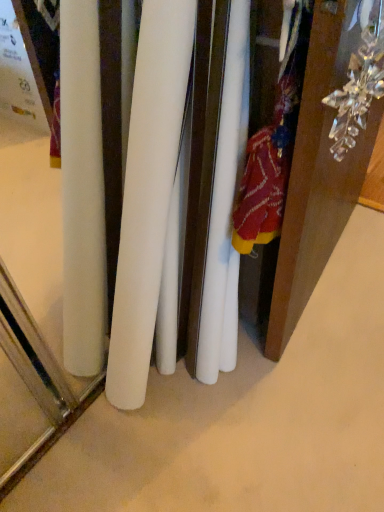
Question: From the image's perspective, is white matte surface at center located above or below clear crystal ornament at upper right?

Choices:
 (A) above
 (B) below

Answer: (B)

Question: Looking at the image, does white matte surface at center seem bigger or smaller compared to clear crystal ornament at upper right?

Choices:
 (A) small
 (B) big

Answer: (B)

Question: Does point (349, 476) appear closer or farther from the camera than point (355, 11)?

Choices:
 (A) closer
 (B) farther

Answer: (B)

Question: From the image's perspective, is clear crystal ornament at upper right positioned above or below white matte surface at center?

Choices:
 (A) below
 (B) above

Answer: (B)

Question: Is clear crystal ornament at upper right spatially inside white matte surface at center, or outside of it?

Choices:
 (A) outside
 (B) inside

Answer: (A)

Question: Based on their positions, is clear crystal ornament at upper right located to the left or right of white matte surface at center?

Choices:
 (A) left
 (B) right

Answer: (B)

Question: Considering the positions of point (354, 81) and point (377, 457), is point (354, 81) closer or farther from the camera than point (377, 457)?

Choices:
 (A) closer
 (B) farther

Answer: (A)